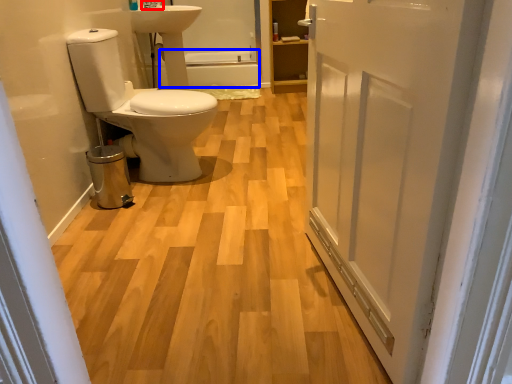
Question: Which point is further to the camera, tap (highlighted by a red box) or bath (highlighted by a blue box)?

Choices:
 (A) tap
 (B) bath

Answer: (B)